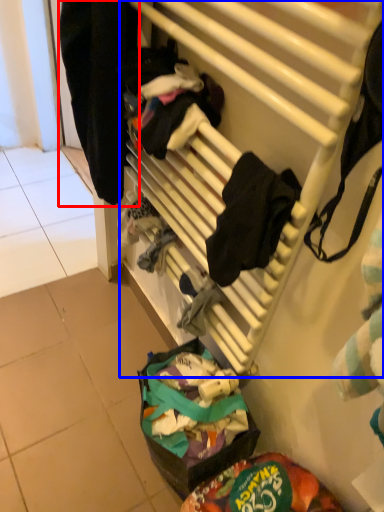
Question: Which point is further to the camera, clothing (highlighted by a red box) or furniture (highlighted by a blue box)?

Choices:
 (A) clothing
 (B) furniture

Answer: (A)